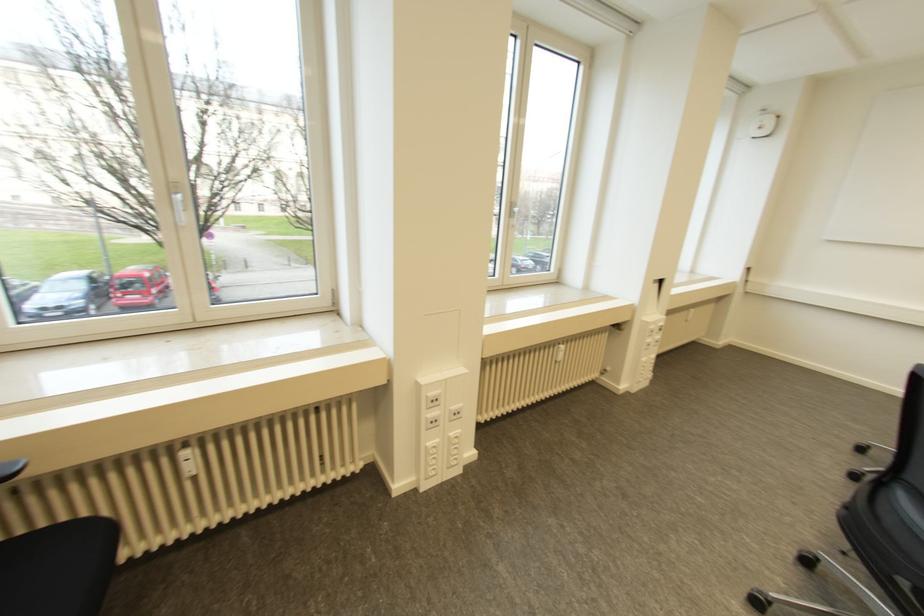
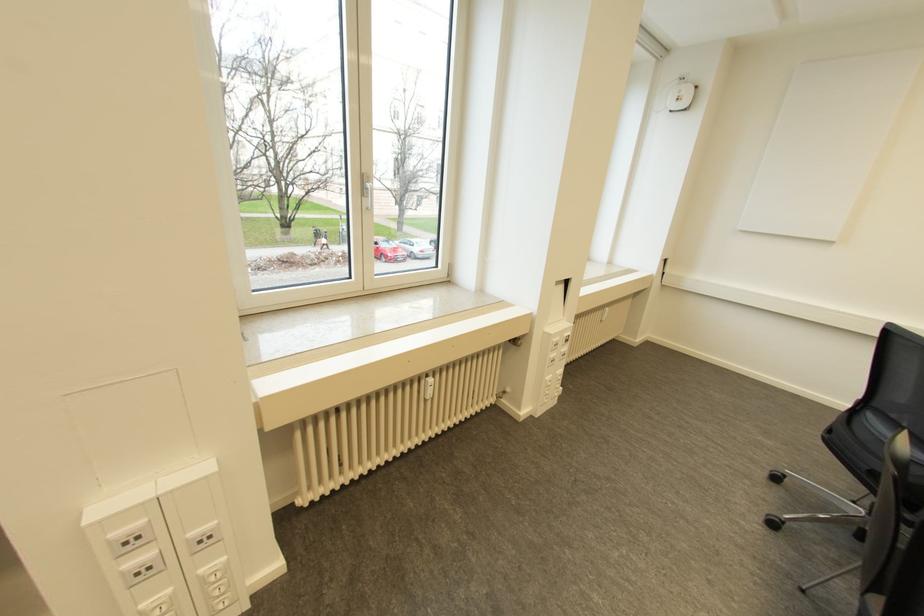
The point at (x=454, y=407) is marked in the first image. Where is the corresponding point in the second image?

(197, 531)